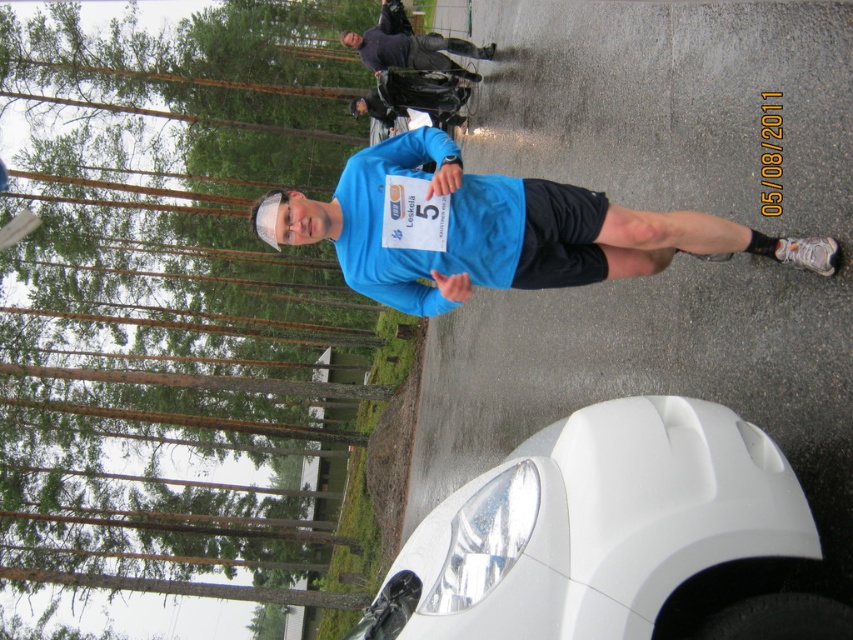
Does white glossy car at lower right lie behind blue fabric shirt at center?

No.

Who is shorter, white glossy car at lower right or blue fabric shirt at center?

Standing shorter between the two is white glossy car at lower right.

Is point (712, 504) positioned in front of point (262, 205)?

Yes, it is in front of point (262, 205).

Identify the location of white glossy car at lower right. (614, 538).